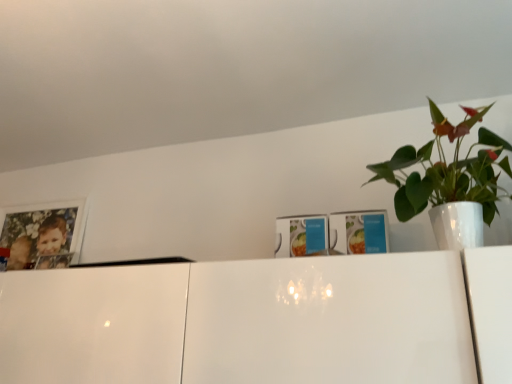
Locate an element on the screen. This screenshot has width=512, height=384. wooden photo frame at upper left is located at coordinates (41, 231).

The height and width of the screenshot is (384, 512). What do you see at coordinates (41, 231) in the screenshot? I see `wooden photo frame at upper left` at bounding box center [41, 231].

Image resolution: width=512 pixels, height=384 pixels. I want to click on green glossy plant at upper right, so click(x=449, y=177).

Describe the element at coordinates (449, 177) in the screenshot. The width and height of the screenshot is (512, 384). I see `green glossy plant at upper right` at that location.

The image size is (512, 384). In order to click on wooden photo frame at upper left in this screenshot , I will do `click(41, 231)`.

Based on their positions, is wooden photo frame at upper left located to the left or right of green glossy plant at upper right?

Based on their positions, wooden photo frame at upper left is located to the left of green glossy plant at upper right.

In the image, is wooden photo frame at upper left positioned in front of or behind green glossy plant at upper right?

Clearly, wooden photo frame at upper left is behind green glossy plant at upper right.

Which is closer, (33, 243) or (425, 180)?

Point (33, 243) appears to be farther away from the viewer than point (425, 180).

From the image's perspective, is wooden photo frame at upper left above or below green glossy plant at upper right?

From the image's perspective, wooden photo frame at upper left appears below green glossy plant at upper right.

From a real-world perspective, does wooden photo frame at upper left sit lower than green glossy plant at upper right?

Incorrect, from a real-world perspective, wooden photo frame at upper left is higher than green glossy plant at upper right.

Is wooden photo frame at upper left wider or thinner than green glossy plant at upper right?

Clearly, wooden photo frame at upper left has less width compared to green glossy plant at upper right.

Which of these two, wooden photo frame at upper left or green glossy plant at upper right, stands shorter?

wooden photo frame at upper left is shorter.

Between wooden photo frame at upper left and green glossy plant at upper right, which one has smaller size?

With smaller size is wooden photo frame at upper left.

Does wooden photo frame at upper left contain green glossy plant at upper right?

No, wooden photo frame at upper left does not contain green glossy plant at upper right.

Is wooden photo frame at upper left with green glossy plant at upper right?

wooden photo frame at upper left is not next to green glossy plant at upper right, and they're not touching.

Is green glossy plant at upper right at the back of wooden photo frame at upper left?

No, wooden photo frame at upper left's orientation is not away from green glossy plant at upper right.

How different are the orientations of wooden photo frame at upper left and green glossy plant at upper right in degrees?

The angular difference between wooden photo frame at upper left and green glossy plant at upper right is 2.36 degrees.

Locate an element on the screen. The width and height of the screenshot is (512, 384). houseplant to the right of wooden photo frame at upper left is located at coordinates (449, 177).

Is green glossy plant at upper right to the left of wooden photo frame at upper left from the viewer's perspective?

No.

Does green glossy plant at upper right come in front of wooden photo frame at upper left?

That is True.

Between point (494, 136) and point (68, 206), which one is positioned in front?

The point (494, 136) is closer.

From the image's perspective, which is below, green glossy plant at upper right or wooden photo frame at upper left?

wooden photo frame at upper left is shown below in the image.

From a real-world perspective, is green glossy plant at upper right positioned above or below wooden photo frame at upper left?

Clearly, from a real-world perspective, green glossy plant at upper right is below wooden photo frame at upper left.

Which object is wider, green glossy plant at upper right or wooden photo frame at upper left?

With larger width is green glossy plant at upper right.

Considering the sizes of objects green glossy plant at upper right and wooden photo frame at upper left in the image provided, who is shorter, green glossy plant at upper right or wooden photo frame at upper left?

wooden photo frame at upper left.

Considering the relative sizes of green glossy plant at upper right and wooden photo frame at upper left in the image provided, is green glossy plant at upper right bigger than wooden photo frame at upper left?

Correct, green glossy plant at upper right is larger in size than wooden photo frame at upper left.

Is green glossy plant at upper right positioned beyond the bounds of wooden photo frame at upper left?

Yes.

Is green glossy plant at upper right far away from wooden photo frame at upper left?

That's right, there is a large distance between green glossy plant at upper right and wooden photo frame at upper left.

Is green glossy plant at upper right oriented away from wooden photo frame at upper left?

That's not correct — green glossy plant at upper right is not looking away from wooden photo frame at upper left.

How different are the orientations of green glossy plant at upper right and wooden photo frame at upper left in degrees?

green glossy plant at upper right and wooden photo frame at upper left are facing 2.36 degrees away from each other.

How far apart are green glossy plant at upper right and wooden photo frame at upper left?

1.38 meters.

Where is `houseplant that appears in front of the wooden photo frame at upper left`? The image size is (512, 384). houseplant that appears in front of the wooden photo frame at upper left is located at coordinates (449, 177).

Identify the location of picture frame located behind the green glossy plant at upper right. (41, 231).

At what (x,y) coordinates should I click in order to perform the action: click on houseplant directly beneath the wooden photo frame at upper left (from a real-world perspective). Please return your answer as a coordinate pair (x, y). The image size is (512, 384). Looking at the image, I should click on (449, 177).